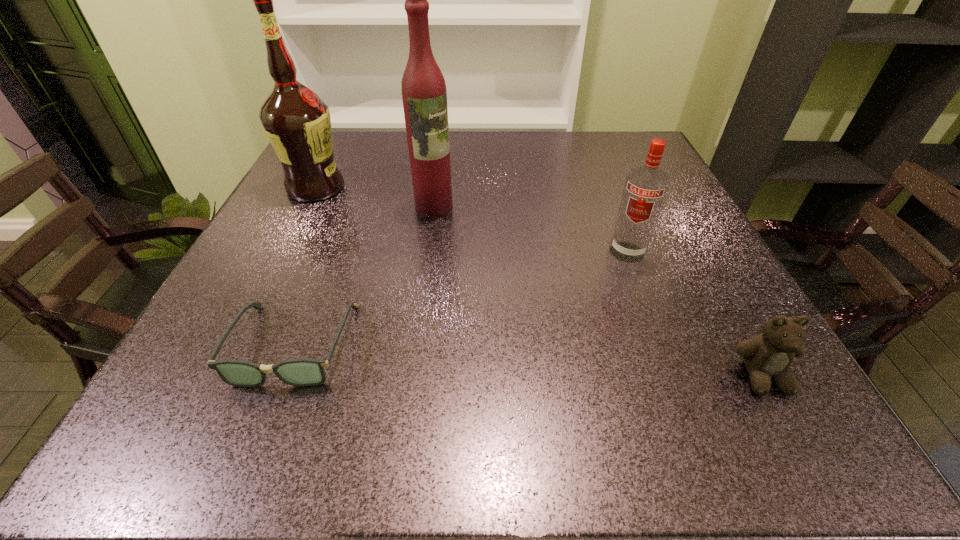
The image size is (960, 540). In order to click on free space located on the front label of the third shortest object in this screenshot , I will do `click(618, 280)`.

Image resolution: width=960 pixels, height=540 pixels. I want to click on free location located 0.240m on the front label of the third shortest object, so click(x=594, y=355).

Where is `blank area located on the front label of the third shortest object`? blank area located on the front label of the third shortest object is located at coordinates (605, 320).

At what (x,y) coordinates should I click in order to perform the action: click on vacant space located on the label of the third object from left to right. Please return your answer as a coordinate pair (x, y). Image resolution: width=960 pixels, height=540 pixels. Looking at the image, I should click on (527, 330).

Find the location of `vacant space located 0.370m on the label of the third object from left to right`. vacant space located 0.370m on the label of the third object from left to right is located at coordinates (531, 334).

Locate an element on the screen. The height and width of the screenshot is (540, 960). vacant space located 0.190m on the label of the third object from left to right is located at coordinates (481, 269).

You are a GUI agent. You are given a task and a screenshot of the screen. Output one action in this format:
    pyautogui.click(x=<x>, y=<y>)
    Task: Click on the object present at the far edge
    The width and height of the screenshot is (960, 540).
    Given the screenshot: What is the action you would take?
    pyautogui.click(x=297, y=122)

Locate an element on the screen. The width and height of the screenshot is (960, 540). spectacles at the near edge is located at coordinates (302, 371).

Locate an element on the screen. teddy bear that is at the near edge is located at coordinates (767, 356).

Identify the location of spectacles present at the left edge. (302, 371).